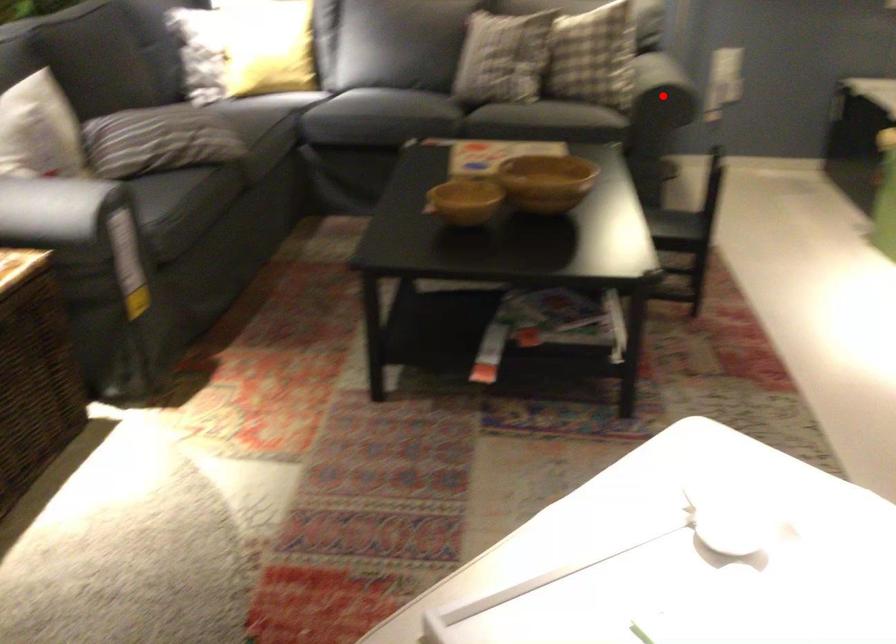
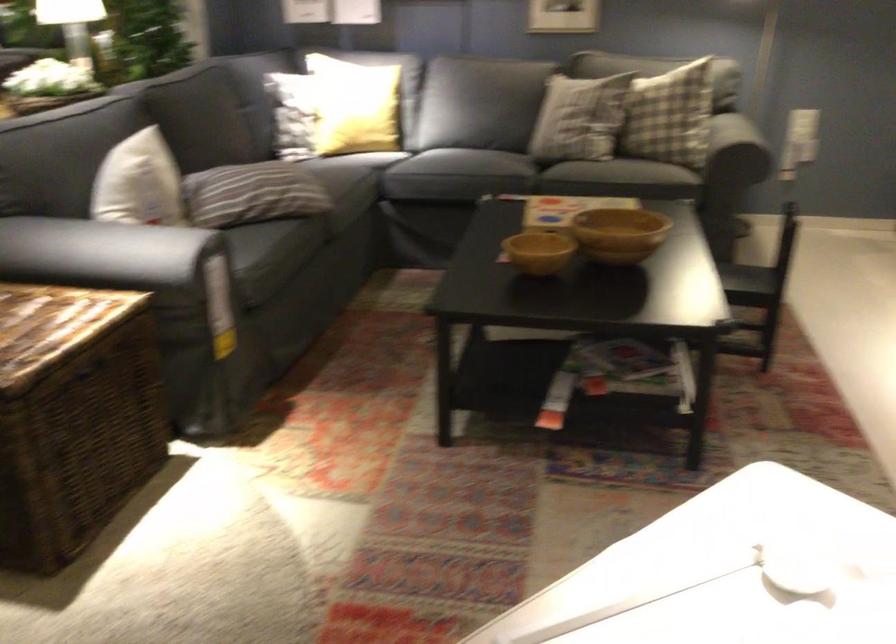
The point at the highlighted location is marked in the first image. Where is the corresponding point in the second image?

(735, 152)